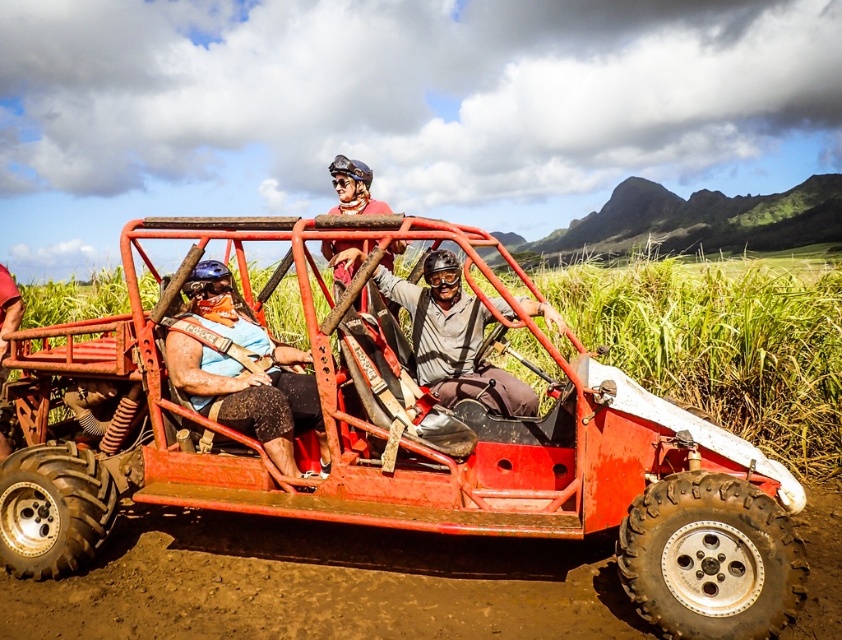
You are a passenger in the matte red helmet at center. You notice a brown muddy dirt track at lower left. Which object is taller?

The matte red helmet at center is taller than the brown muddy dirt track at lower left.